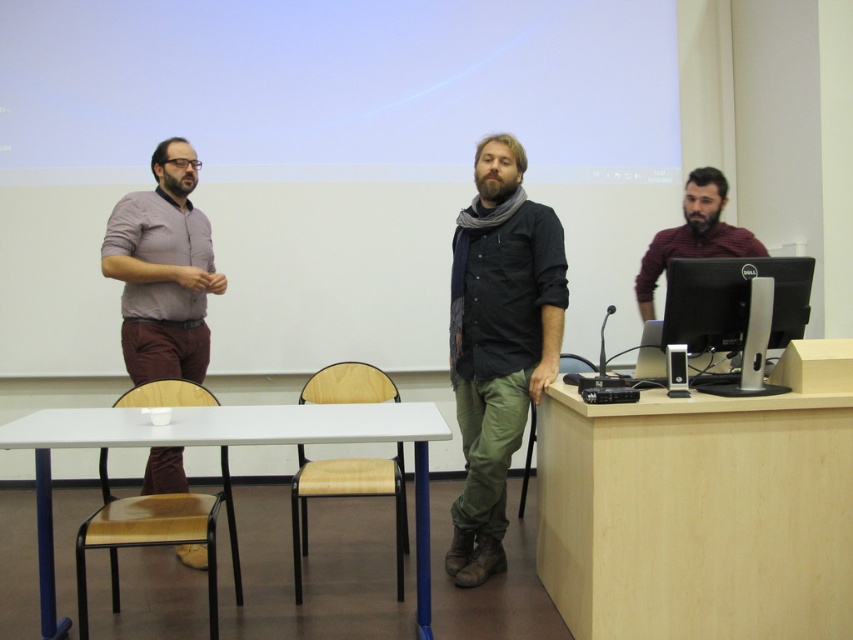
You are a student sitting at the white plastic table at center in the classroom. You want to reach the white matte projection screen at upper center to adjust its position. Considering your current position, which direction should you move to get closer to the screen?

Since the white matte projection screen at upper center is further to the viewer than the white plastic table at center, you should move forward towards the screen to get closer to it.

You are a student entering the classroom and need to locate the white matte projection screen at upper center and the white plastic table at center. Based on their positions, which object is closer to the right wall?

The white matte projection screen at upper center is positioned on the right side of the white plastic table at center, so it is closer to the right wall.